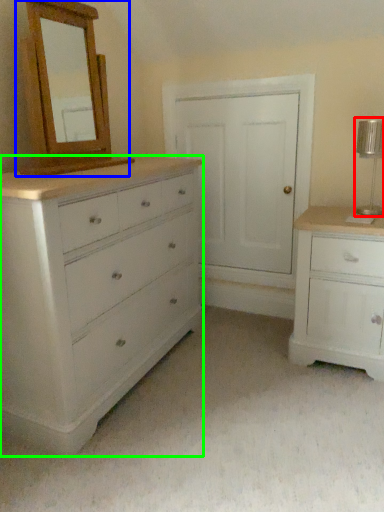
Question: Estimate the real-world distances between objects in this image. Which object is closer to table lamp (highlighted by a red box), medicine cabinet (highlighted by a blue box) or chest of drawers (highlighted by a green box)?

Choices:
 (A) medicine cabinet
 (B) chest of drawers

Answer: (B)